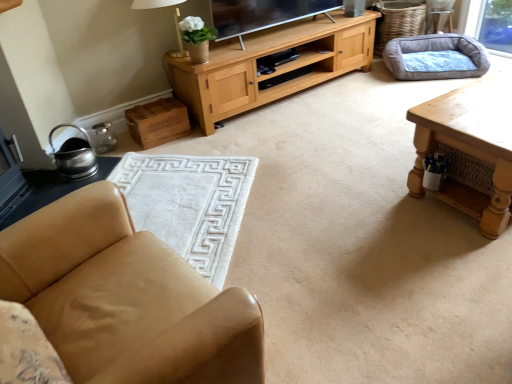
Where is `vacant area that is situated to the right of tan leather chair at lower left`? vacant area that is situated to the right of tan leather chair at lower left is located at coordinates (332, 313).